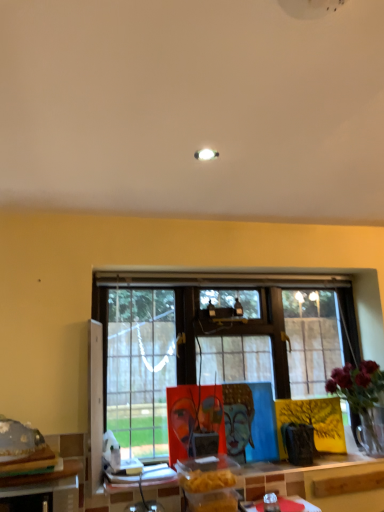
Question: From the image's perspective, is green leafy plant at right positioned above or below shiny metallic food at lower left?

Choices:
 (A) above
 (B) below

Answer: (B)

Question: Do you think green leafy plant at right is within shiny metallic food at lower left, or outside of it?

Choices:
 (A) inside
 (B) outside

Answer: (B)

Question: Based on their relative distances, which object is farther from the wooden table at lower center, the 2th table from the left?

Choices:
 (A) green leafy plant at right
 (B) wooden table at lower left, which is the 1th table from left to right
 (C) shiny metallic food at lower left

Answer: (C)

Question: Which is nearer to the green leafy plant at right?

Choices:
 (A) wooden table at lower center, arranged as the 2th table when viewed from the front
 (B) wooden table at lower left, the 2th table from the right
 (C) shiny metallic food at lower left

Answer: (A)